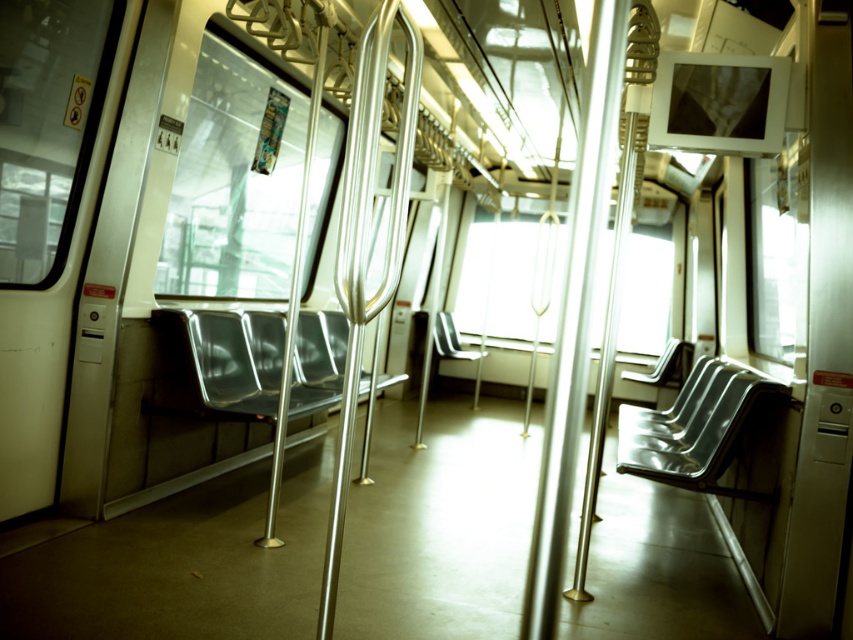
Question: Can you confirm if polished metal handrail at center is thinner than metallic silver chair at center?

Choices:
 (A) yes
 (B) no

Answer: (A)

Question: Does polished metal handrail at center appear under metallic silver seat at right?

Choices:
 (A) yes
 (B) no

Answer: (B)

Question: Which object is positioned closest to the metallic silver seat at right?

Choices:
 (A) polished metal handrail at center
 (B) metallic silver seat at center
 (C) metallic silver chair at center

Answer: (A)

Question: Which point is closer to the camera taking this photo?

Choices:
 (A) (689, 349)
 (B) (457, 337)
 (C) (358, 205)
 (D) (717, 440)

Answer: (C)

Question: Which point appears farthest from the camera in this image?

Choices:
 (A) (360, 68)
 (B) (643, 467)
 (C) (643, 372)

Answer: (C)

Question: Is polished metal handrail at center to the left of metallic silver seat at right from the viewer's perspective?

Choices:
 (A) no
 (B) yes

Answer: (B)